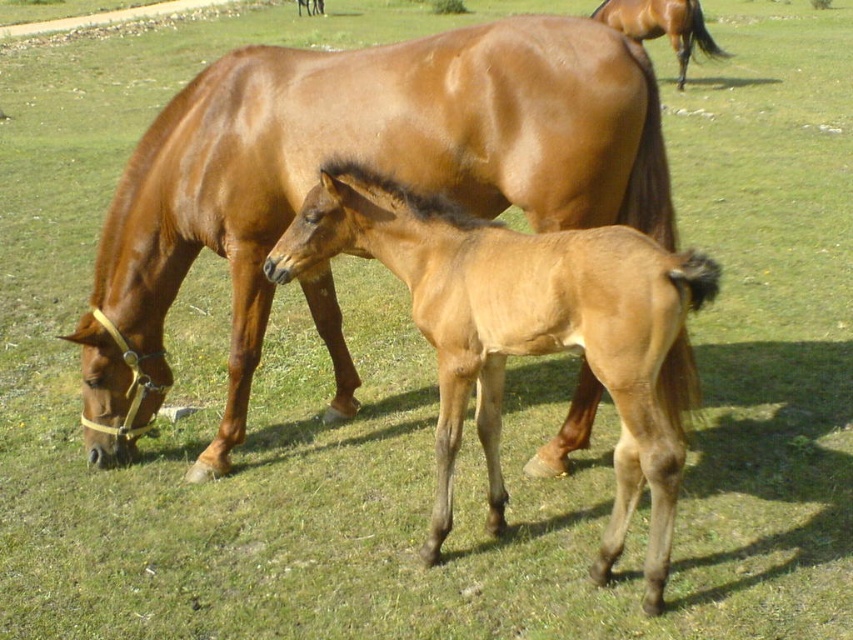
You are a farmer who wants to separate the glossy brown horse at center and the light brown glossy foal at center with a fence. What is the minimum width of the fence needed to fit between them?

The glossy brown horse at center is 26.92 inches from the light brown glossy foal at center, so the minimum width of the fence needed is 26.92 inches to fit between them.

You are a farmer checking the space in the barn. You need to fit both the glossy brown horse at center and the light brown glossy foal at center into a stall that is 2 meters wide. The stall can only accommodate one horse at a time. Which horse would require more space in the stall?

The glossy brown horse at center has a greater width than the light brown glossy foal at center, so it would require more space in the stall.

You are a farmer who wants to ensure both the glossy brown horse at center and the light brown glossy foal at center have enough space to move freely in the field. Based on their sizes, which horse requires more space to move around comfortably?

The glossy brown horse at center is bigger than the light brown glossy foal at center, so it requires more space to move around comfortably.